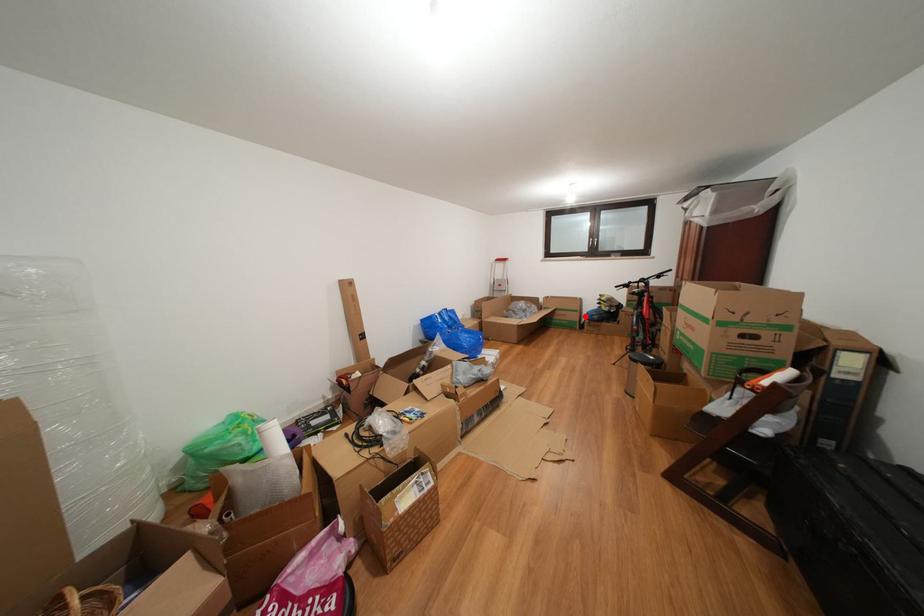
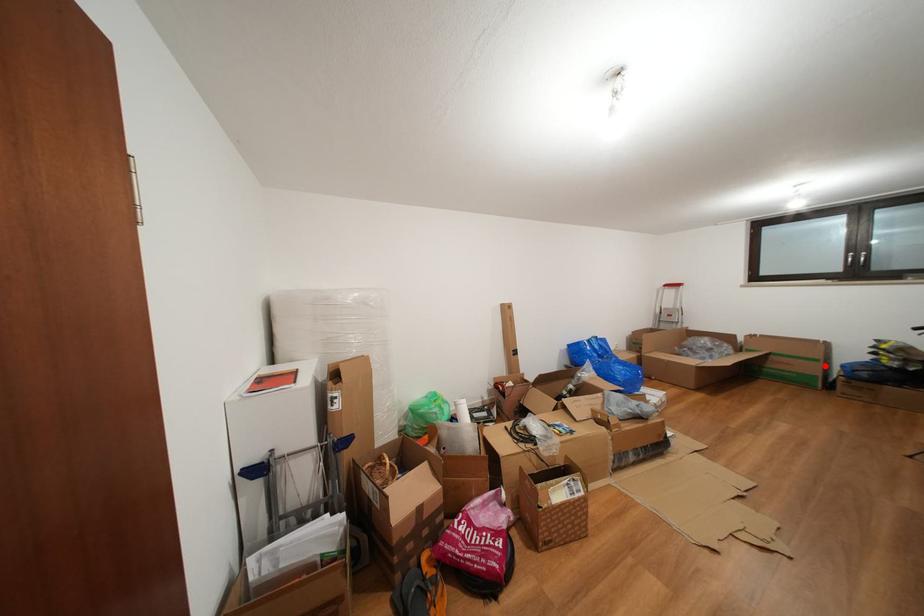
I am providing you with two images of the same scene from different viewpoints. A red point is marked on the first image and another point is marked on the second image. Is the marked point in image1 the same physical position as the marked point in image2?

Yes